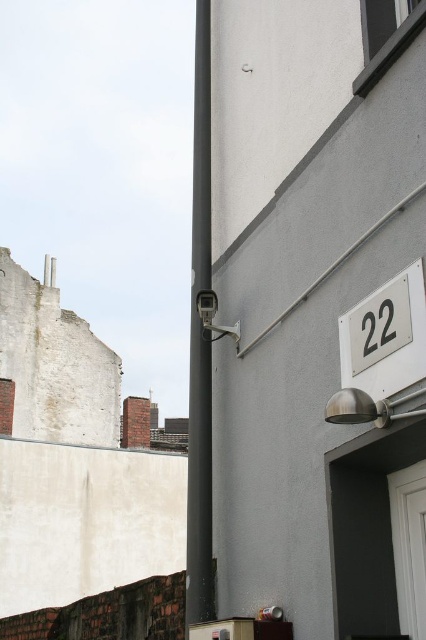
You are a delivery person trying to find the correct address. You see the white glossy number plate at right and the white plastic number at upper right. Which one is lower in position?

The white glossy number plate at right is positioned under the white plastic number at upper right, so it is lower in position.

You are a window cleaner who needs to clean both the black matte pole at center and the white glossy number plate at right. Which object should you clean first if you start from the ground and move upwards?

You should clean the white glossy number plate at right first because the black matte pole at center is taller, so you would need to climb higher to reach it later.